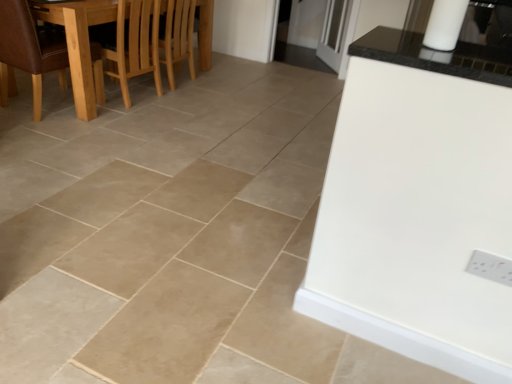
Question: Is light brown wooden chair at upper left bigger than wooden dining table at left?

Choices:
 (A) no
 (B) yes

Answer: (A)

Question: Considering the relative sizes of light brown wooden chair at upper left and wooden dining table at left in the image provided, is light brown wooden chair at upper left taller than wooden dining table at left?

Choices:
 (A) yes
 (B) no

Answer: (B)

Question: Considering the relative positions of light brown wooden chair at upper left and wooden dining table at left in the image provided, is light brown wooden chair at upper left in front of wooden dining table at left?

Choices:
 (A) yes
 (B) no

Answer: (B)

Question: Considering the relative sizes of light brown wooden chair at upper left and wooden dining table at left in the image provided, is light brown wooden chair at upper left thinner than wooden dining table at left?

Choices:
 (A) no
 (B) yes

Answer: (B)

Question: Is light brown wooden chair at upper left not within wooden dining table at left?

Choices:
 (A) yes
 (B) no

Answer: (B)

Question: Is light brown wooden chair at upper left aimed at wooden dining table at left?

Choices:
 (A) no
 (B) yes

Answer: (B)

Question: Considering the relative sizes of brown leather chair at left and white plastic electric outlet at lower right in the image provided, is brown leather chair at left taller than white plastic electric outlet at lower right?

Choices:
 (A) yes
 (B) no

Answer: (A)

Question: Does brown leather chair at left have a lesser height compared to white plastic electric outlet at lower right?

Choices:
 (A) no
 (B) yes

Answer: (A)

Question: Does brown leather chair at left come in front of white plastic electric outlet at lower right?

Choices:
 (A) yes
 (B) no

Answer: (B)

Question: Considering the relative sizes of brown leather chair at left and white plastic electric outlet at lower right in the image provided, is brown leather chair at left thinner than white plastic electric outlet at lower right?

Choices:
 (A) no
 (B) yes

Answer: (A)

Question: Is brown leather chair at left wider than white plastic electric outlet at lower right?

Choices:
 (A) no
 (B) yes

Answer: (B)

Question: Can you confirm if brown leather chair at left is bigger than white plastic electric outlet at lower right?

Choices:
 (A) no
 (B) yes

Answer: (B)

Question: From a real-world perspective, does light brown wooden chair at upper left sit lower than white plastic electric outlet at lower right?

Choices:
 (A) yes
 (B) no

Answer: (A)